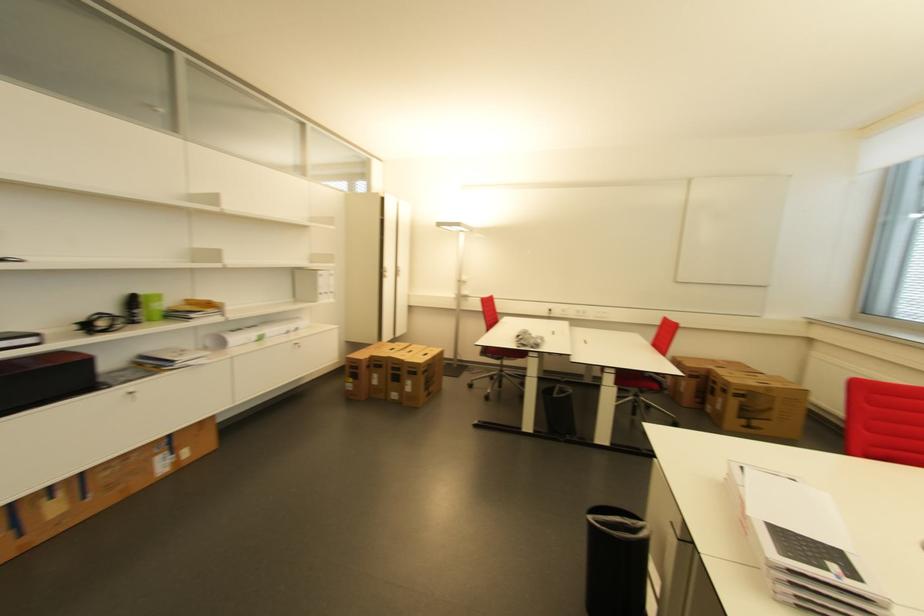
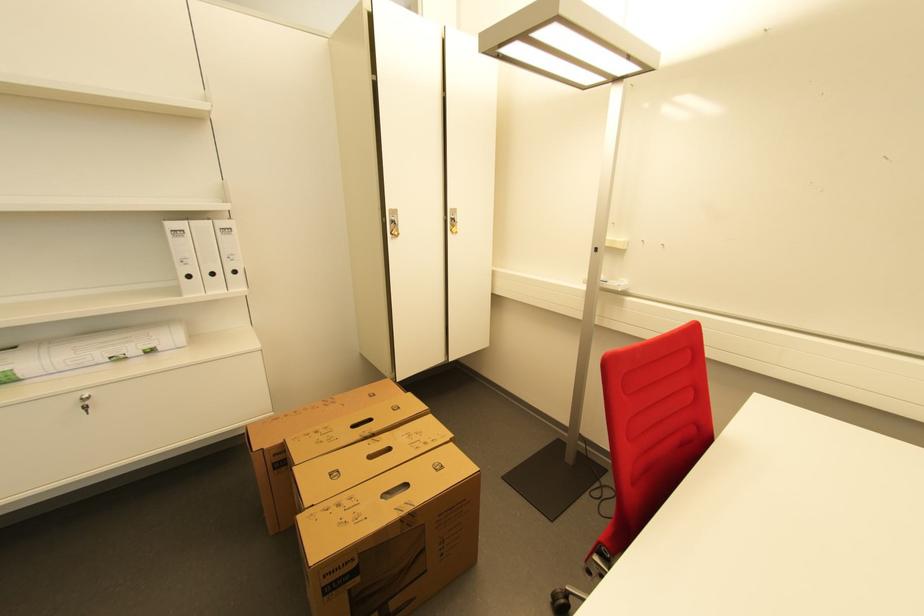
Where in the second image is the point corresponding to the point at 335,294 from the first image?

(239, 273)